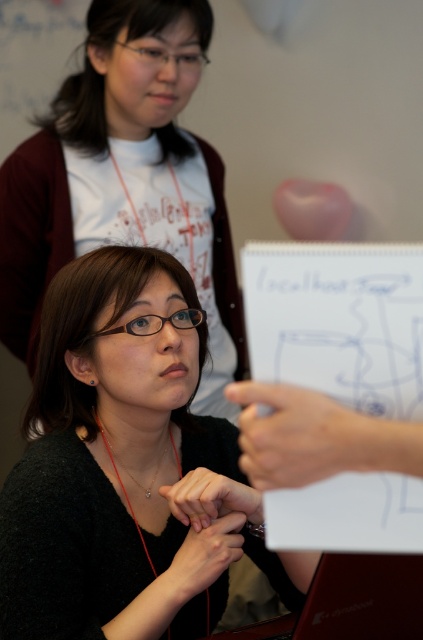
Does point (175, 253) come in front of point (106, 440)?

No, (175, 253) is further to viewer.

Locate an element on the screen. The width and height of the screenshot is (423, 640). matte black shirt at center is located at coordinates (123, 179).

Which is in front, point (195, 209) or point (151, 484)?

Point (151, 484)

Where is `matte black shirt at center`? This screenshot has height=640, width=423. matte black shirt at center is located at coordinates (123, 179).

Is black matte sweater at center below gold chain necklace at center?

Actually, black matte sweater at center is above gold chain necklace at center.

Does point (65, 340) lie behind point (128, 470)?

No, (65, 340) is in front of (128, 470).

Is point (101, 477) less distant than point (148, 492)?

Yes, it is in front of point (148, 492).

Identify the location of black matte sweater at center. (126, 467).

Which of these two, black matte sweater at center or matte black shirt at center, stands shorter?

black matte sweater at center is shorter.

Does point (184, 508) come closer to viewer compared to point (69, 113)?

Yes, point (184, 508) is in front of point (69, 113).

Who is more distant from viewer, (195, 566) or (93, 205)?

Point (93, 205)

You are a GUI agent. You are given a task and a screenshot of the screen. Output one action in this format:
    pyautogui.click(x=<x>, y=<y>)
    Task: Click on the black matte sweater at center
    Image resolution: width=423 pixels, height=640 pixels.
    Given the screenshot: What is the action you would take?
    pyautogui.click(x=126, y=467)